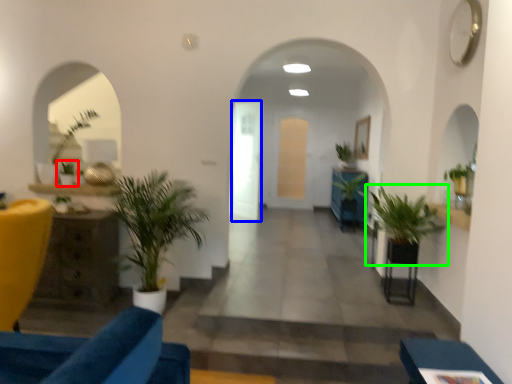
Question: Based on their relative distances, which object is nearer to houseplant (highlighted by a red box)? Choose from glass door (highlighted by a blue box) and houseplant (highlighted by a green box).

Choices:
 (A) glass door
 (B) houseplant

Answer: (B)